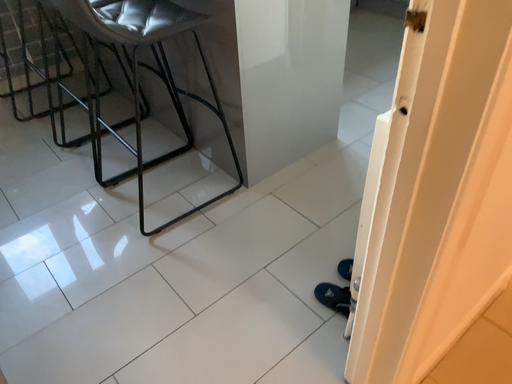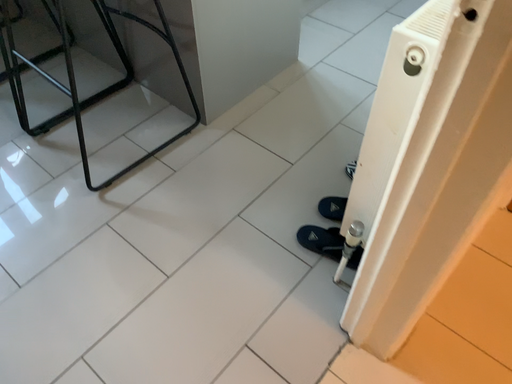
Question: How did the camera likely rotate when shooting the video?

Choices:
 (A) rotated downward
 (B) rotated upward

Answer: (A)